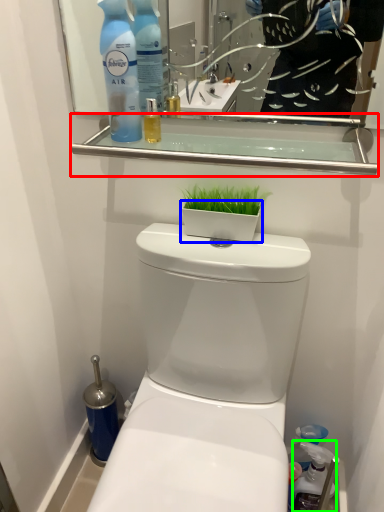
Question: Based on their relative distances, which object is farther from balustrade (highlighted by a red box)? Choose from flowerpot (highlighted by a blue box) and cleaning product (highlighted by a green box).

Choices:
 (A) flowerpot
 (B) cleaning product

Answer: (B)